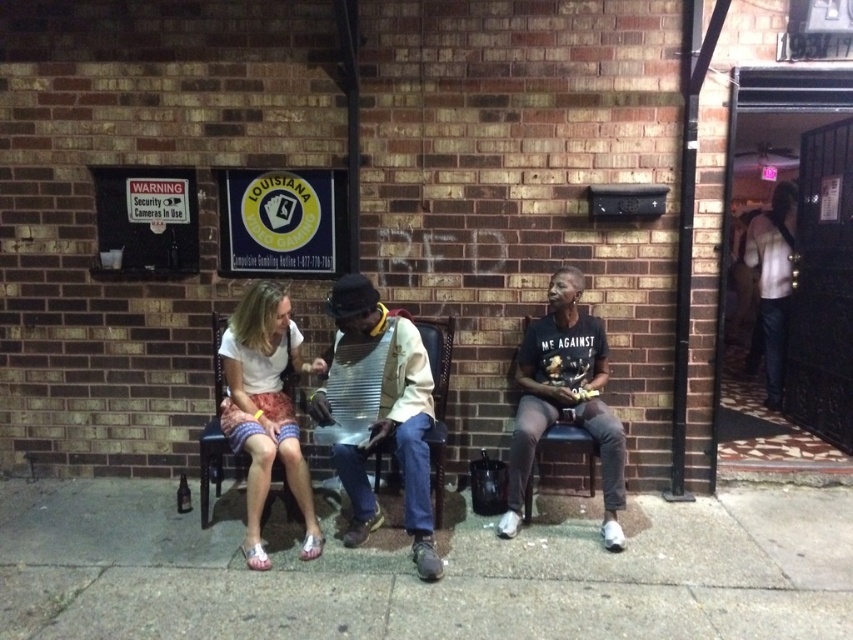
Question: Which object appears closest to the camera in this image?

Choices:
 (A) white fabric skirt at center
 (B) metallic washboard at center
 (C) gray concrete pavement at lower center

Answer: (C)

Question: Does gray concrete pavement at lower center appear on the left side of metallic washboard at center?

Choices:
 (A) yes
 (B) no

Answer: (B)

Question: Which of the following is the closest to the observer?

Choices:
 (A) metallic washboard at center
 (B) white fabric skirt at center
 (C) white shirt at right
 (D) gray concrete pavement at lower center

Answer: (D)

Question: Can you confirm if gray concrete pavement at lower center is positioned above metallic washboard at center?

Choices:
 (A) yes
 (B) no

Answer: (B)

Question: Which object is positioned closest to the white fabric skirt at center?

Choices:
 (A) white shirt at right
 (B) black matte t-shirt at center
 (C) metallic washboard at center

Answer: (C)

Question: Is metallic washboard at center positioned in front of black matte t-shirt at center?

Choices:
 (A) yes
 (B) no

Answer: (A)